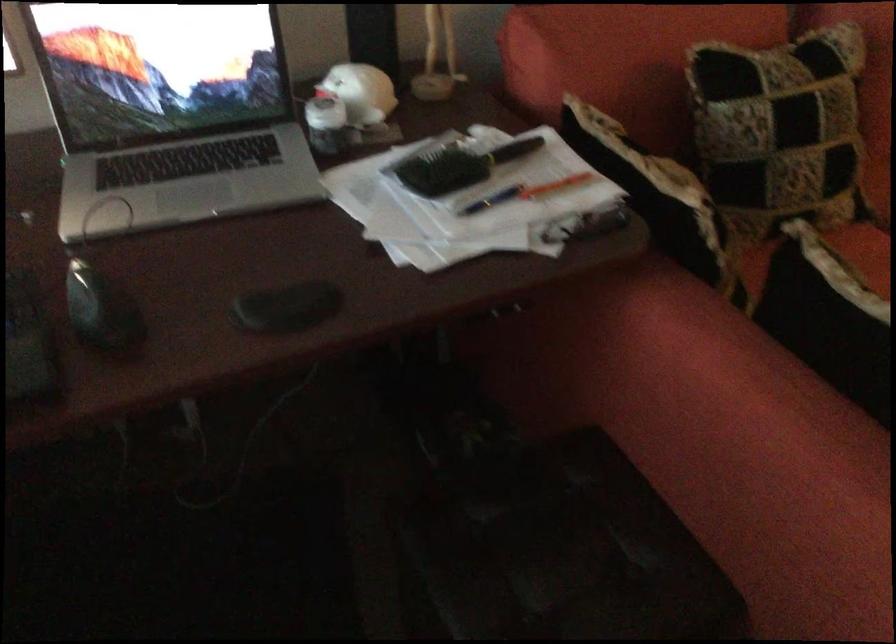
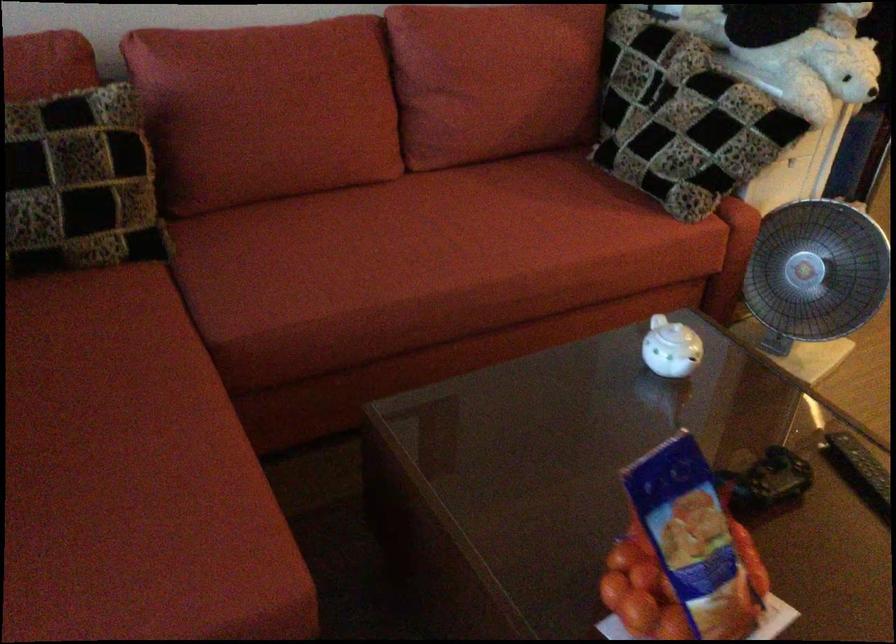
Question: What movement of the cameraman would produce the second image?

Choices:
 (A) Left
 (B) Right
 (C) Forward
 (D) Backward

Answer: (B)